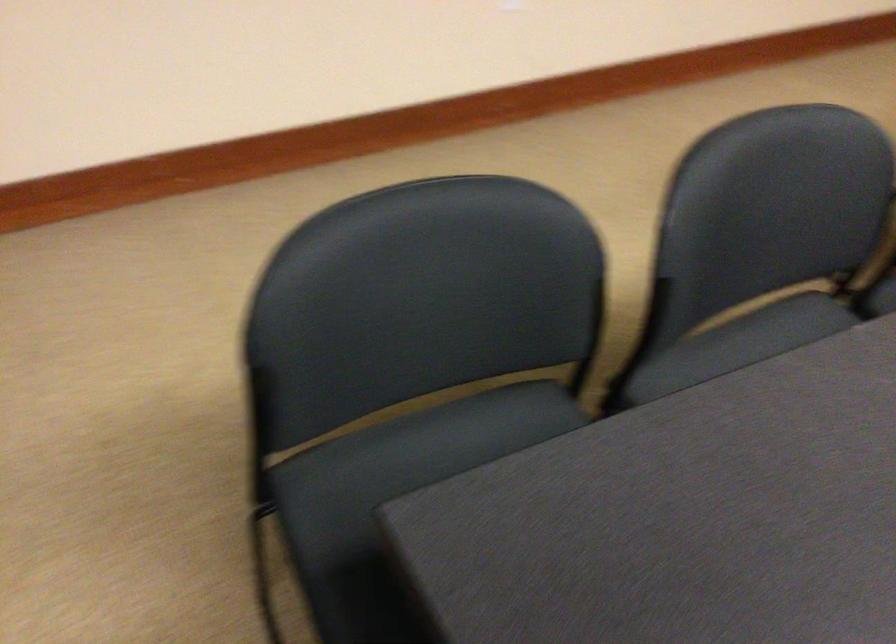
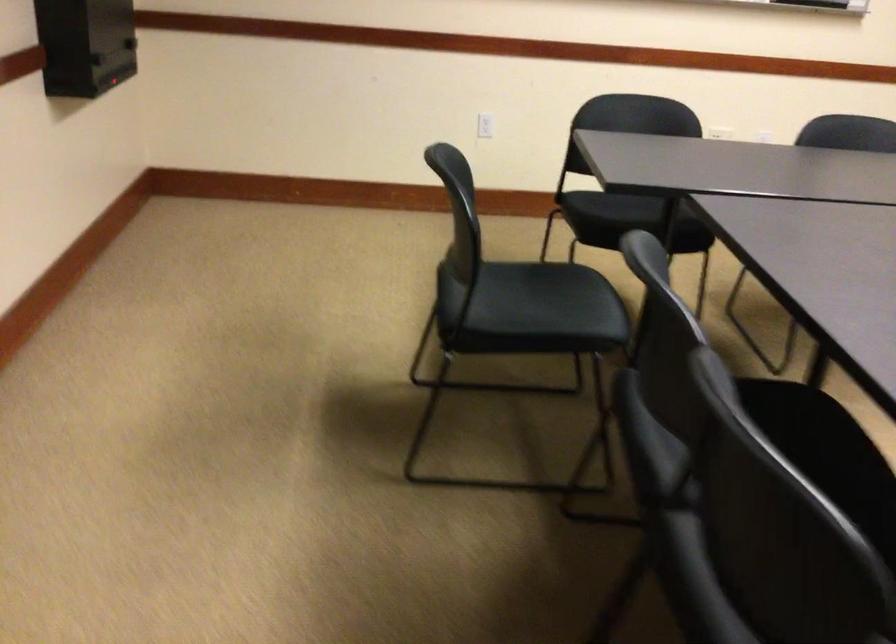
The first image is from the beginning of the video and the second image is from the end. How did the camera likely rotate when shooting the video?

The rotation direction of the camera is right-down.